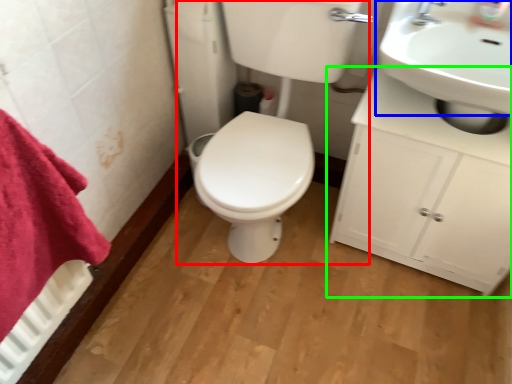
Question: Considering the real-world distances, which object is closest to porcelain (highlighted by a red box)? sink (highlighted by a blue box) or bathroom cabinet (highlighted by a green box).

Choices:
 (A) sink
 (B) bathroom cabinet

Answer: (B)